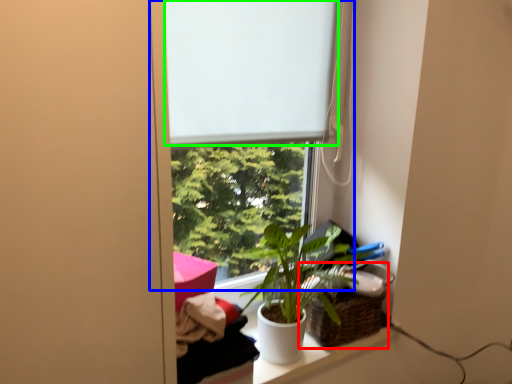
Question: Which object is the farthest from basket (highlighted by a red box)? Choose among these: window (highlighted by a blue box) or window screen (highlighted by a green box).

Choices:
 (A) window
 (B) window screen

Answer: (B)